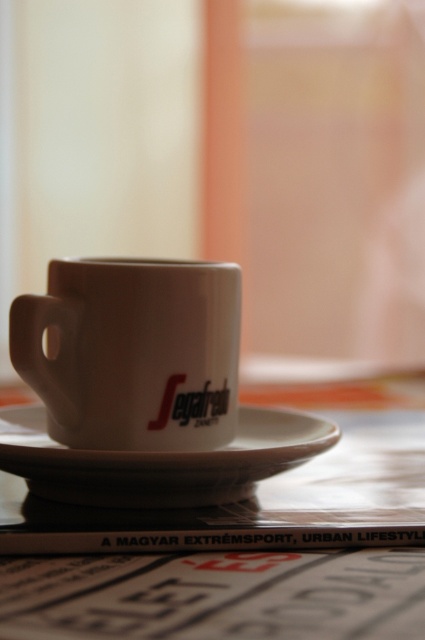
You are setting up a coffee table for a cozy afternoon. You have a white matte mug at center and a white ceramic saucer at center. If you want to place them so that the mug is on the left side of the saucer, does their current arrangement already achieve this?

Yes, the white matte mug at center is already positioned to the left of the white ceramic saucer at center, so their current arrangement meets the requirement.

You are setting up a small table for a tea ceremony. You have a white glossy table at center and a white matte mug at center. Which object is wider?

The white glossy table at center is wider than the white matte mug at center.

You are setting up a small table for a tea ceremony. You have a white ceramic saucer at center and a white glossy table at center. Which object should you place the tea set on to ensure it sits higher?

The white glossy table at center has a greater height compared to the white ceramic saucer at center, so you should place the tea set on the white glossy table at center to ensure it sits higher.